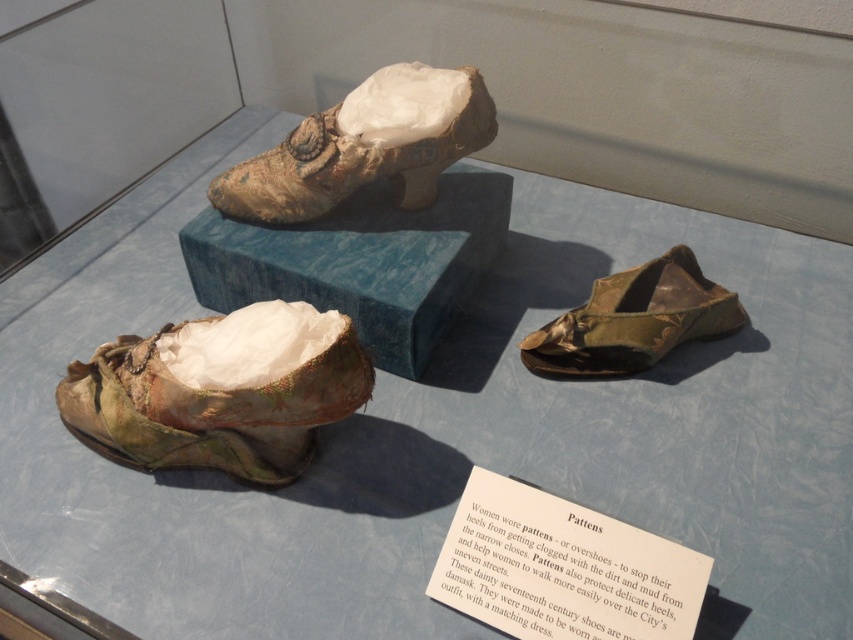
Question: From the image, what is the correct spatial relationship of matte gold fabric shoe at upper center in relation to green fabric shoe at lower right?

Choices:
 (A) above
 (B) below

Answer: (A)

Question: Among these objects, which one is farthest from the camera?

Choices:
 (A) green fabric shoe at lower right
 (B) matte gold fabric shoe at upper center
 (C) green satin shoe at lower left

Answer: (A)

Question: Is green satin shoe at lower left thinner than green fabric shoe at lower right?

Choices:
 (A) no
 (B) yes

Answer: (A)

Question: Is matte gold fabric shoe at upper center to the right of green fabric shoe at lower right from the viewer's perspective?

Choices:
 (A) yes
 (B) no

Answer: (B)

Question: Which of the following is the farthest from the observer?

Choices:
 (A) green satin shoe at lower left
 (B) matte gold fabric shoe at upper center

Answer: (B)

Question: Which object is positioned farthest from the matte gold fabric shoe at upper center?

Choices:
 (A) green satin shoe at lower left
 (B) green fabric shoe at lower right

Answer: (B)